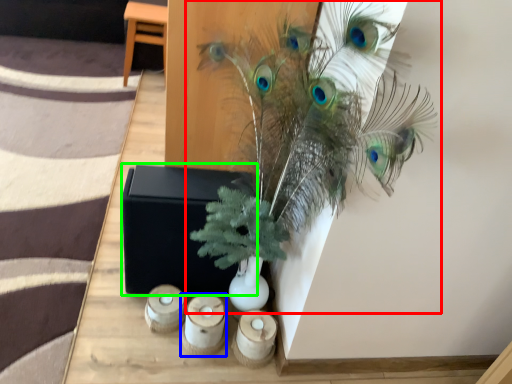
Question: Based on their relative distances, which object is nearer to houseplant (highlighted by a red box)? Choose from candle holder (highlighted by a blue box) and box (highlighted by a green box).

Choices:
 (A) candle holder
 (B) box

Answer: (B)